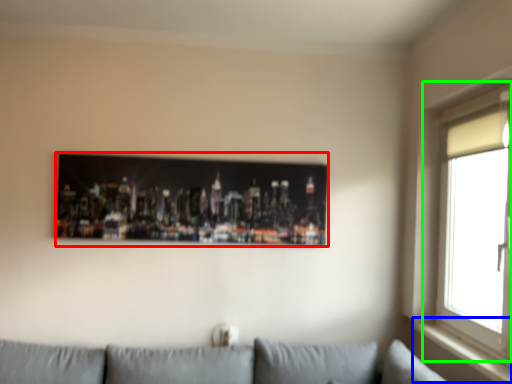
Question: Which object is positioned closest to picture frame (highlighted by a red box)? Select from window sill (highlighted by a blue box) and window (highlighted by a green box).

Choices:
 (A) window sill
 (B) window

Answer: (B)